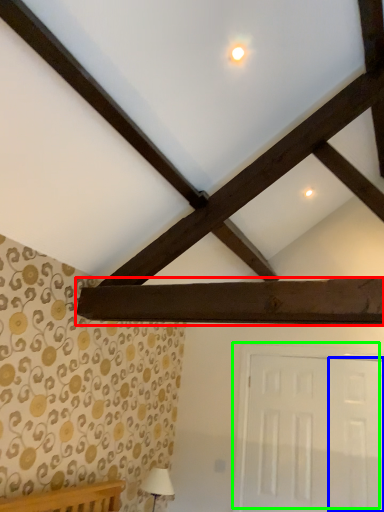
Question: Considering the real-world distances, which object is farthest from plank (highlighted by a red box)? door (highlighted by a blue box) or door (highlighted by a green box)?

Choices:
 (A) door
 (B) door

Answer: (B)